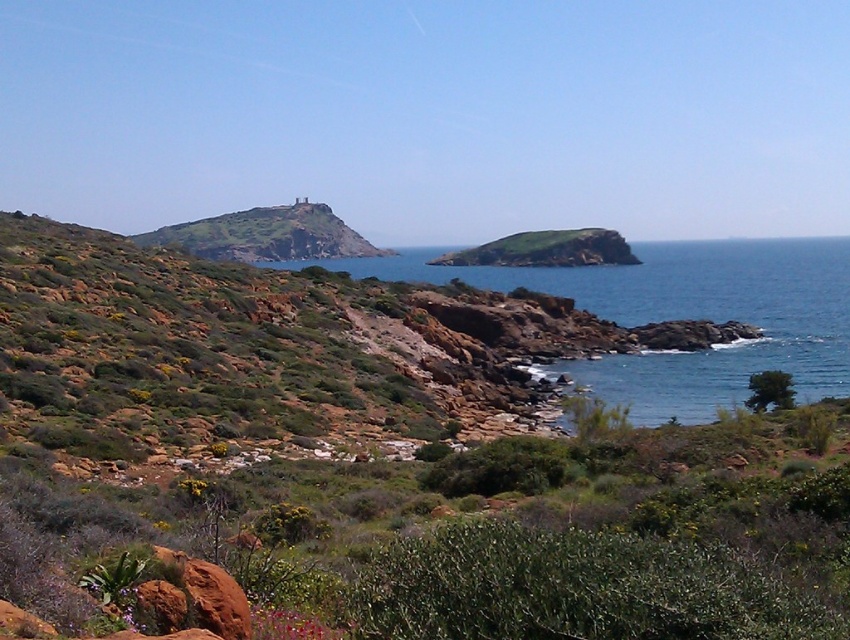
Question: Based on their relative distances, which object is farther from the green grassy hillside at center?

Choices:
 (A) green grassy hillside at left
 (B) blue water at center
 (C) green leafy bush at lower right
 (D) green shrubbery at center

Answer: (D)

Question: Which point appears farthest from the camera in this image?

Choices:
 (A) (763, 396)
 (B) (669, 602)
 (C) (697, 378)

Answer: (C)

Question: Does green shrubbery at center appear under green leafy bush at lower right?

Choices:
 (A) no
 (B) yes

Answer: (A)

Question: Can you confirm if green shrubbery at center is bigger than green grassy hillside at left?

Choices:
 (A) no
 (B) yes

Answer: (A)

Question: Estimate the real-world distances between objects in this image. Which object is closer to the green leafy bush at lower right?

Choices:
 (A) green grassy hillside at left
 (B) green shrubbery at center
 (C) green grassy hillside at center
 (D) blue water at center

Answer: (B)

Question: Does green shrubbery at center have a smaller size compared to green leafy bush at lower right?

Choices:
 (A) no
 (B) yes

Answer: (B)